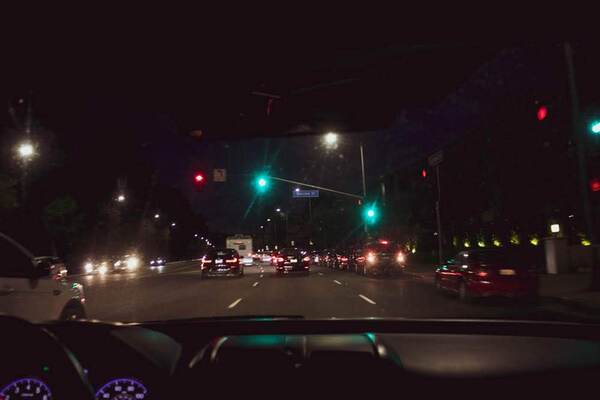
Find the location of a particular element. Image resolution: width=600 pixels, height=400 pixels. green light is located at coordinates (261, 182).